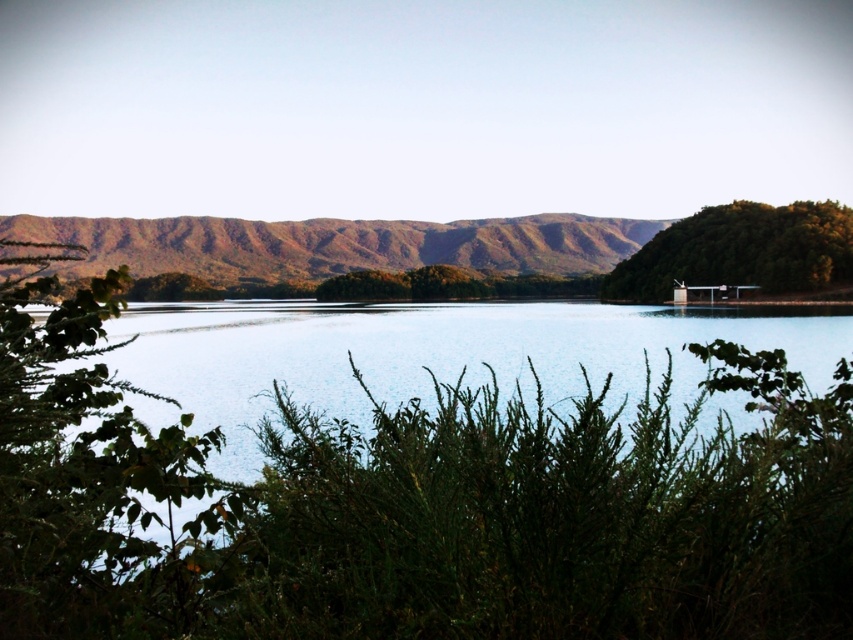
What do you see at coordinates (430, 356) in the screenshot? I see `clear blue water at center` at bounding box center [430, 356].

Does clear blue water at center have a greater width compared to green leafy bush at left?

Yes, clear blue water at center is wider than green leafy bush at left.

Who is more distant from viewer, (669, 356) or (181, 611)?

Positioned behind is point (181, 611).

You are a GUI agent. You are given a task and a screenshot of the screen. Output one action in this format:
    pyautogui.click(x=<x>, y=<y>)
    Task: Click on the clear blue water at center
    
    Given the screenshot: What is the action you would take?
    pyautogui.click(x=430, y=356)

Who is positioned more to the right, green leafy bush at left or brown textured mountain at center?

From the viewer's perspective, green leafy bush at left appears more on the right side.

Where is `green leafy bush at left`? green leafy bush at left is located at coordinates (96, 477).

Between point (12, 540) and point (386, 236), which one is positioned behind?

Point (386, 236)

This screenshot has height=640, width=853. Identify the location of green leafy bush at left. (96, 477).

Does clear blue water at center have a smaller size compared to brown textured mountain at center?

Indeed, clear blue water at center has a smaller size compared to brown textured mountain at center.

In the scene shown: Does clear blue water at center appear under brown textured mountain at center?

Yes, clear blue water at center is below brown textured mountain at center.

Measure the distance between point (178, 362) and camera.

Point (178, 362) and camera are 64.76 meters apart.

This screenshot has height=640, width=853. Find the location of `clear blue water at center`. clear blue water at center is located at coordinates (430, 356).